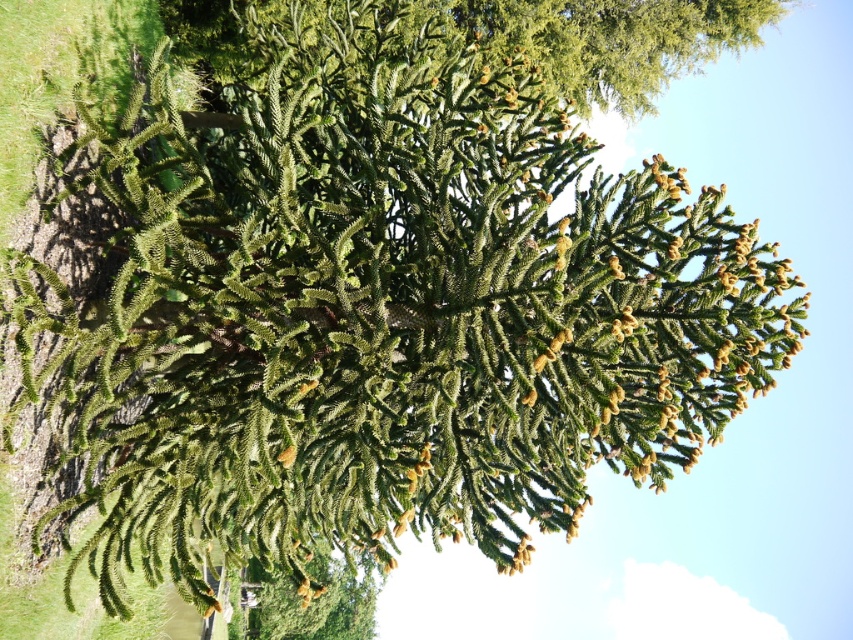
Question: Can you confirm if green needle-like at center is positioned above green textured pine cone at lower center?

Choices:
 (A) no
 (B) yes

Answer: (B)

Question: Is green needle-like at center thinner than green textured pine cone at lower center?

Choices:
 (A) no
 (B) yes

Answer: (A)

Question: Among these objects, which one is farthest from the camera?

Choices:
 (A) green textured pine cone at lower center
 (B) green needle-like at center

Answer: (A)

Question: Is the position of green needle-like at center less distant than that of green textured pine cone at lower center?

Choices:
 (A) no
 (B) yes

Answer: (B)